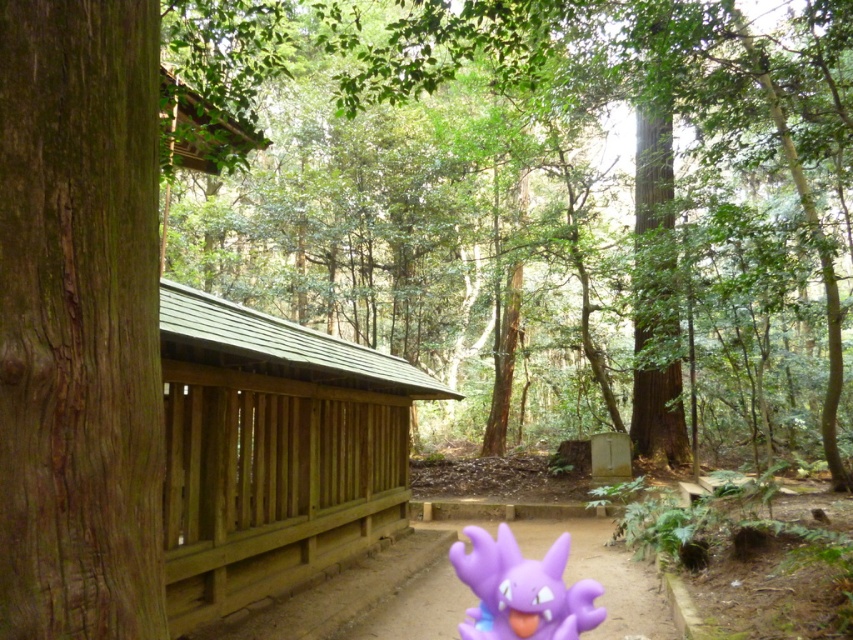
Can you confirm if brown wooden fence at left is shorter than purple rubber toy at lower center?

Incorrect, brown wooden fence at left's height does not fall short of purple rubber toy at lower center's.

Is point (496, 198) positioned after point (521, 600)?

Yes, point (496, 198) is farther from viewer.

Identify the location of brown wooden fence at left. (561, 212).

Who is shorter, brown wooden fence at left or brown rough bark tree at left?

Standing shorter between the two is brown rough bark tree at left.

Does brown wooden fence at left lie behind brown rough bark tree at left?

Yes, it is.

This screenshot has width=853, height=640. What do you see at coordinates (561, 212) in the screenshot? I see `brown wooden fence at left` at bounding box center [561, 212].

Find the location of a particular element. The image size is (853, 640). brown wooden fence at left is located at coordinates (561, 212).

Which is more to the right, brown rough bark tree at left or purple rubber toy at lower center?

purple rubber toy at lower center is more to the right.

Does brown rough bark tree at left appear over purple rubber toy at lower center?

Yes.

Where is `brown rough bark tree at left`? The width and height of the screenshot is (853, 640). brown rough bark tree at left is located at coordinates (79, 321).

I want to click on brown rough bark tree at left, so click(x=79, y=321).